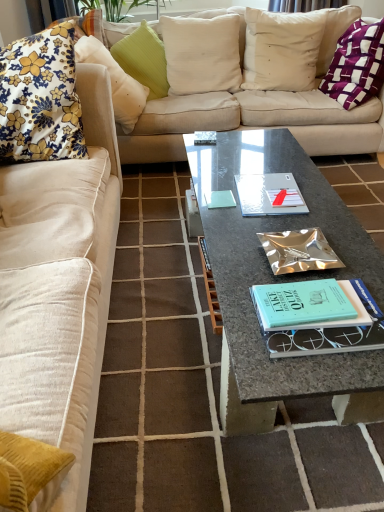
Where is `granite coffee table at center`? granite coffee table at center is located at coordinates (279, 282).

Image resolution: width=384 pixels, height=512 pixels. Describe the element at coordinates (356, 65) in the screenshot. I see `purple woven pillow at upper right, positioned as the 1th pillow in right-to-left order` at that location.

The height and width of the screenshot is (512, 384). What do you see at coordinates (253, 87) in the screenshot? I see `beige fabric couch at upper center, the second studio couch viewed from the front` at bounding box center [253, 87].

The height and width of the screenshot is (512, 384). I want to click on granite coffee table at center, so click(x=279, y=282).

Considering the positions of objects white cotton pillow at upper center, the fifth pillow in the left-to-right sequence, and beige fabric couch at upper center, which is the first studio couch from back to front, in the image provided, who is more to the right, white cotton pillow at upper center, the fifth pillow in the left-to-right sequence, or beige fabric couch at upper center, which is the first studio couch from back to front,?

white cotton pillow at upper center, the fifth pillow in the left-to-right sequence, is more to the right.

Is white cotton pillow at upper center, marked as the second pillow in a right-to-left arrangement, positioned with its back to beige fabric couch at upper center, the second studio couch viewed from the front?

Yes.

Looking at this image, from the image's perspective, between white cotton pillow at upper center, the fifth pillow in the left-to-right sequence, and beige fabric couch at upper center, which is the first studio couch from back to front, which one is located above?

white cotton pillow at upper center, the fifth pillow in the left-to-right sequence, appears higher in the image.

Does floral fabric cushion at upper left, which appears as the 2th pillow when viewed from the left, have a larger size compared to purple woven pillow at upper right, positioned as the 1th pillow in right-to-left order?

No, floral fabric cushion at upper left, which appears as the 2th pillow when viewed from the left, is not bigger than purple woven pillow at upper right, positioned as the 1th pillow in right-to-left order.

The height and width of the screenshot is (512, 384). Find the location of `pillow that is the 2nd object above the purple woven pillow at upper right, positioned as the 1th pillow in right-to-left order (from a real-world perspective)`. pillow that is the 2nd object above the purple woven pillow at upper right, positioned as the 1th pillow in right-to-left order (from a real-world perspective) is located at coordinates (115, 82).

Which is more to the left, floral fabric cushion at upper left, which appears as the 2th pillow when viewed from the left, or purple woven pillow at upper right, arranged as the 6th pillow when viewed from the left?

floral fabric cushion at upper left, which appears as the 2th pillow when viewed from the left, is more to the left.

From a real-world perspective, who is located higher, floral fabric cushion at upper left, which appears as the 2th pillow when viewed from the left, or purple woven pillow at upper right, positioned as the 1th pillow in right-to-left order?

In real-world perspective, floral fabric cushion at upper left, which appears as the 2th pillow when viewed from the left, is above.

Do you think green textured pillow at upper center, positioned as the 3th pillow in left-to-right order, is within floral fabric cushion at left, which is the sixth pillow in right-to-left order, or outside of it?

green textured pillow at upper center, positioned as the 3th pillow in left-to-right order, is not inside floral fabric cushion at left, which is the sixth pillow in right-to-left order, it's outside.

From the image's perspective, would you say green textured pillow at upper center, positioned as the 3th pillow in left-to-right order, is shown under floral fabric cushion at left, which is the sixth pillow in right-to-left order?

No.

Considering the relative positions of green textured pillow at upper center, the fourth pillow in the right-to-left sequence, and floral fabric cushion at left, which is the sixth pillow in right-to-left order, in the image provided, is green textured pillow at upper center, the fourth pillow in the right-to-left sequence, to the left of floral fabric cushion at left, which is the sixth pillow in right-to-left order, from the viewer's perspective?

No, green textured pillow at upper center, the fourth pillow in the right-to-left sequence, is not to the left of floral fabric cushion at left, which is the sixth pillow in right-to-left order.

From a real-world perspective, which pillow is the 5th one above the green textured pillow at upper center, the fourth pillow in the right-to-left sequence? Please provide its 2D coordinates.

[(40, 98)]

Considering the sizes of objects white linen pillow at upper center, which is the third pillow in right-to-left order, and floral fabric cushion at left, which is the sixth pillow in right-to-left order, in the image provided, who is shorter, white linen pillow at upper center, which is the third pillow in right-to-left order, or floral fabric cushion at left, which is the sixth pillow in right-to-left order,?

white linen pillow at upper center, which is the third pillow in right-to-left order.

From the image's perspective, is white linen pillow at upper center, which is the 4th pillow in left-to-right order, located beneath floral fabric cushion at left, which is the sixth pillow in right-to-left order?

No, from the image's perspective, white linen pillow at upper center, which is the 4th pillow in left-to-right order, is not below floral fabric cushion at left, which is the sixth pillow in right-to-left order.

From a real-world perspective, is white linen pillow at upper center, which is the 4th pillow in left-to-right order, located beneath floral fabric cushion at left, which is the sixth pillow in right-to-left order?

Yes, from a real-world perspective, white linen pillow at upper center, which is the 4th pillow in left-to-right order, is below floral fabric cushion at left, which is the sixth pillow in right-to-left order.

Is white linen pillow at upper center, which is the third pillow in right-to-left order, smaller than floral fabric cushion at left, arranged as the 1th pillow when viewed from the left?

Yes.

This screenshot has height=512, width=384. I want to click on paperback book below the purple woven pillow at upper right, positioned as the 1th pillow in right-to-left order (from a real-world perspective), so click(x=269, y=194).

Considering the positions of objects silver metallic notebook at center and purple woven pillow at upper right, positioned as the 1th pillow in right-to-left order, in the image provided, who is in front, silver metallic notebook at center or purple woven pillow at upper right, positioned as the 1th pillow in right-to-left order,?

silver metallic notebook at center is more forward.

From the picture: From the image's perspective, is silver metallic notebook at center positioned above or below purple woven pillow at upper right, positioned as the 1th pillow in right-to-left order?

Clearly, from the image's perspective, silver metallic notebook at center is below purple woven pillow at upper right, positioned as the 1th pillow in right-to-left order.

Looking at this image, how far apart are silver metallic notebook at center and purple woven pillow at upper right, arranged as the 6th pillow when viewed from the left?

silver metallic notebook at center and purple woven pillow at upper right, arranged as the 6th pillow when viewed from the left, are 4.41 feet apart.

Does beige fabric couch at upper center, the second studio couch viewed from the front, appear on the right side of purple woven pillow at upper right, arranged as the 6th pillow when viewed from the left?

No, beige fabric couch at upper center, the second studio couch viewed from the front, is not to the right of purple woven pillow at upper right, arranged as the 6th pillow when viewed from the left.

Is beige fabric couch at upper center, which is the first studio couch from back to front, positioned with its back to purple woven pillow at upper right, positioned as the 1th pillow in right-to-left order?

Yes, beige fabric couch at upper center, which is the first studio couch from back to front, is positioned with its back facing purple woven pillow at upper right, positioned as the 1th pillow in right-to-left order.

Is beige fabric couch at upper center, which is the first studio couch from back to front, positioned behind purple woven pillow at upper right, arranged as the 6th pillow when viewed from the left?

No, beige fabric couch at upper center, which is the first studio couch from back to front, is closer to the viewer.

From the image's perspective, which one is positioned higher, beige fabric couch at upper center, the second studio couch viewed from the front, or purple woven pillow at upper right, positioned as the 1th pillow in right-to-left order?

purple woven pillow at upper right, positioned as the 1th pillow in right-to-left order, appears higher in the image.

Between purple woven pillow at upper right, positioned as the 1th pillow in right-to-left order, and granite coffee table at center, which one has smaller width?

purple woven pillow at upper right, positioned as the 1th pillow in right-to-left order.

Considering the points (364, 28) and (238, 329), which point is in front, point (364, 28) or point (238, 329)?

The point (238, 329) is in front.

Between purple woven pillow at upper right, arranged as the 6th pillow when viewed from the left, and granite coffee table at center, which one has more height?

Standing taller between the two is purple woven pillow at upper right, arranged as the 6th pillow when viewed from the left.

Identify the location of the 1st pillow counting from the right of the beige fabric couch at upper center, the second studio couch viewed from the front. (281, 49).

You are a GUI agent. You are given a task and a screenshot of the screen. Output one action in this format:
    pyautogui.click(x=<x>, y=<y>)
    Task: Click on the 1st pillow behind the floral fabric cushion at upper left, the fifth pillow viewed from the right
    
    Given the screenshot: What is the action you would take?
    pyautogui.click(x=356, y=65)

Estimate the real-world distances between objects in this image. Which object is closer to floral fabric cushion at left, arranged as the 1th pillow when viewed from the left, fluffy beige couch at left, marked as the first studio couch in a front-to-back arrangement, or granite coffee table at center?

fluffy beige couch at left, marked as the first studio couch in a front-to-back arrangement, is closer to floral fabric cushion at left, arranged as the 1th pillow when viewed from the left.

From the image, which object appears to be nearer to floral fabric cushion at left, which is the sixth pillow in right-to-left order, white linen pillow at upper center, which is the 4th pillow in left-to-right order, or beige fabric couch at upper center, the second studio couch viewed from the front?

Among the two, beige fabric couch at upper center, the second studio couch viewed from the front, is located nearer to floral fabric cushion at left, which is the sixth pillow in right-to-left order.

Estimate the real-world distances between objects in this image. Which object is closer to metallic silver book at center, green textured pillow at upper center, the fourth pillow in the right-to-left sequence, or white linen pillow at upper center, which is the 4th pillow in left-to-right order?

white linen pillow at upper center, which is the 4th pillow in left-to-right order, is closer to metallic silver book at center.

Looking at the image, which one is located closer to purple woven pillow at upper right, arranged as the 6th pillow when viewed from the left, green textured pillow at upper center, the fourth pillow in the right-to-left sequence, or beige fabric couch at upper center, which is the first studio couch from back to front?

beige fabric couch at upper center, which is the first studio couch from back to front, lies closer to purple woven pillow at upper right, arranged as the 6th pillow when viewed from the left, than the other object.

From the image, which object appears to be farther from metallic silver book at center, green textured pillow at upper center, positioned as the 3th pillow in left-to-right order, or granite coffee table at center?

green textured pillow at upper center, positioned as the 3th pillow in left-to-right order.

Which object lies further to the anchor point granite coffee table at center, silver metallic notebook at center or white cotton pillow at upper center, marked as the second pillow in a right-to-left arrangement?

white cotton pillow at upper center, marked as the second pillow in a right-to-left arrangement, lies further to granite coffee table at center than the other object.

Estimate the real-world distances between objects in this image. Which object is further from fluffy beige couch at left, which is the 2th studio couch from back to front, beige fabric couch at upper center, the second studio couch viewed from the front, or purple woven pillow at upper right, arranged as the 6th pillow when viewed from the left?

purple woven pillow at upper right, arranged as the 6th pillow when viewed from the left, is further to fluffy beige couch at left, which is the 2th studio couch from back to front.

When comparing their distances from purple woven pillow at upper right, positioned as the 1th pillow in right-to-left order, does fluffy beige couch at left, marked as the first studio couch in a front-to-back arrangement, or white cotton pillow at upper center, marked as the second pillow in a right-to-left arrangement, seem further?

fluffy beige couch at left, marked as the first studio couch in a front-to-back arrangement, is positioned further to the anchor purple woven pillow at upper right, positioned as the 1th pillow in right-to-left order.

Locate an element on the screen. book located between floral fabric cushion at left, which is the sixth pillow in right-to-left order, and purple woven pillow at upper right, arranged as the 6th pillow when viewed from the left, in the left-right direction is located at coordinates (298, 251).

The height and width of the screenshot is (512, 384). I want to click on paperback book between floral fabric cushion at upper left, which appears as the 2th pillow when viewed from the left, and purple woven pillow at upper right, positioned as the 1th pillow in right-to-left order, in the horizontal direction, so click(269, 194).

The width and height of the screenshot is (384, 512). Find the location of `coffee table between fluffy beige couch at left, marked as the first studio couch in a front-to-back arrangement, and purple woven pillow at upper right, arranged as the 6th pillow when viewed from the left, along the z-axis`. coffee table between fluffy beige couch at left, marked as the first studio couch in a front-to-back arrangement, and purple woven pillow at upper right, arranged as the 6th pillow when viewed from the left, along the z-axis is located at coordinates (279, 282).

You are a GUI agent. You are given a task and a screenshot of the screen. Output one action in this format:
    pyautogui.click(x=<x>, y=<y>)
    Task: Click on the book located between fluffy beige couch at left, which is the 2th studio couch from back to front, and floral fabric cushion at upper left, which appears as the 2th pillow when viewed from the left, in the depth direction
    
    Given the screenshot: What is the action you would take?
    pyautogui.click(x=298, y=251)